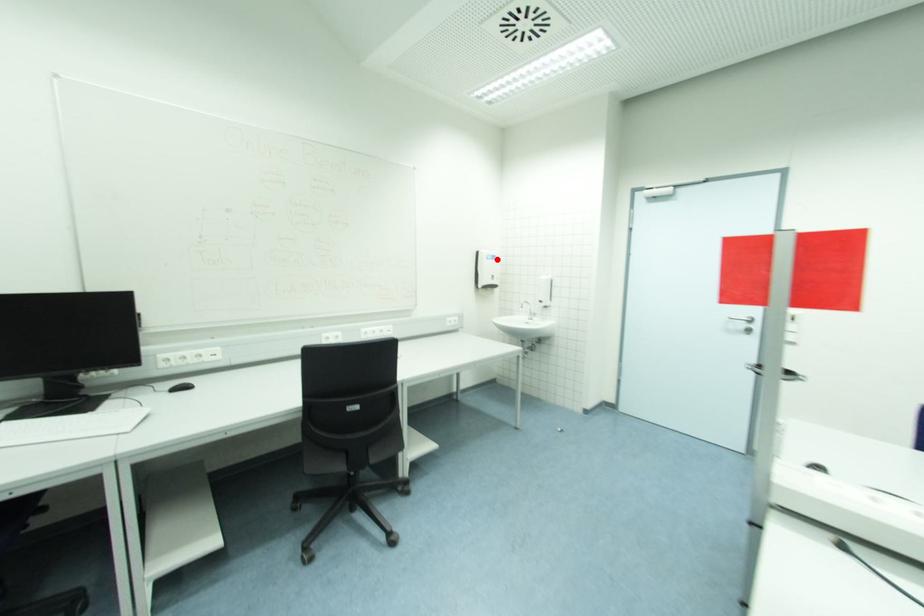
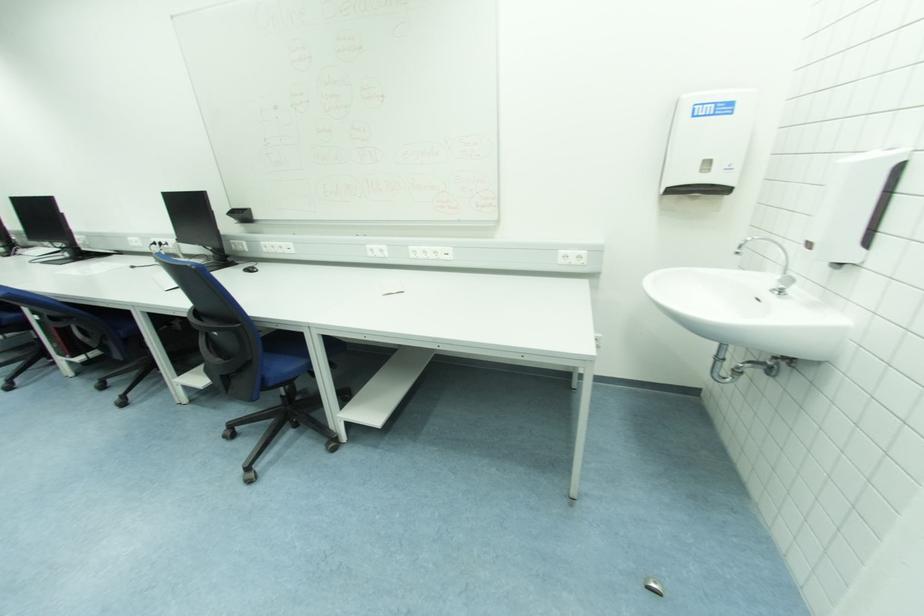
Question: I am providing you with two images of the same scene from different viewpoints. Given a red point in image1, look at the same physical point in image2. Is it:

Choices:
 (A) Closer to the viewpoint
 (B) Farther from the viewpoint

Answer: (B)